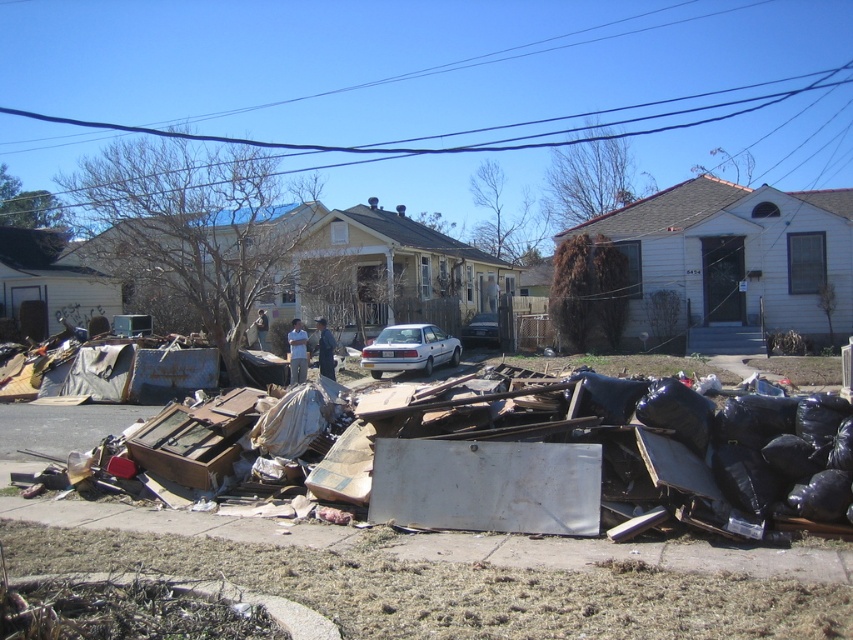
You are a delivery driver who needs to park your truck near the silver metallic sedan at center without blocking the rusty cardboard boxes at lower center. Based on the scene, where should you position your truck?

You should park your truck to the left of the silver metallic sedan at center since the rusty cardboard boxes at lower center are located to the right of the sedan, so parking on the left would avoid blocking them.

You are a drone operator tasked with mapping the disaster area. You need to mark the exact 2D coordinates of the rusty cardboard boxes at lower center. What are their coordinates?

The rusty cardboard boxes at lower center are located at coordinates (595, 456).